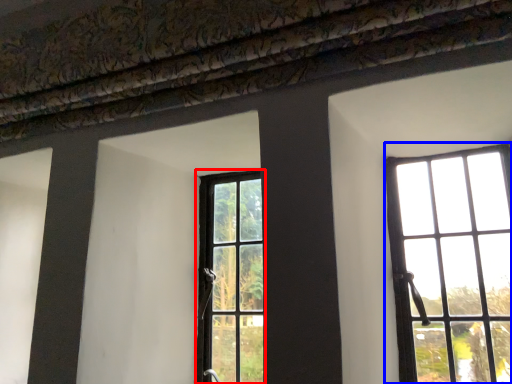
Question: Which point is closer to the camera, window (highlighted by a red box) or window (highlighted by a blue box)?

Choices:
 (A) window
 (B) window

Answer: (B)